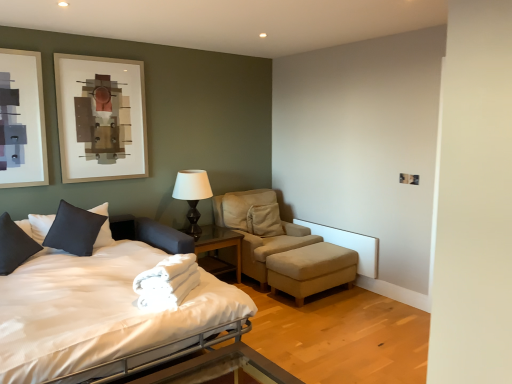
Question: From the image's perspective, is metallic silver bed frame at lower center located above or below beige fabric ottoman at lower right?

Choices:
 (A) below
 (B) above

Answer: (A)

Question: Is metallic silver bed frame at lower center wider or thinner than beige fabric ottoman at lower right?

Choices:
 (A) thin
 (B) wide

Answer: (B)

Question: Estimate the real-world distances between objects in this image. Which object is farther from the beige fabric chair at center?

Choices:
 (A) matte black pillow at left, which appears as the 2th pillow when viewed from the right
 (B) white satin bed at left
 (C) matte black table lamp at center
 (D) dark gray fabric pillow at left, which is counted as the 1th pillow, starting from the right
 (E) glass/metal nightstand at center

Answer: (A)

Question: Estimate the real-world distances between objects in this image. Which object is farther from the beige fabric ottoman at lower right?

Choices:
 (A) metallic silver bed frame at lower center
 (B) beige fabric chair at center
 (C) matte black pillow at left, arranged as the first pillow when viewed from the left
 (D) white satin bed at left
 (E) matte black table lamp at center

Answer: (C)